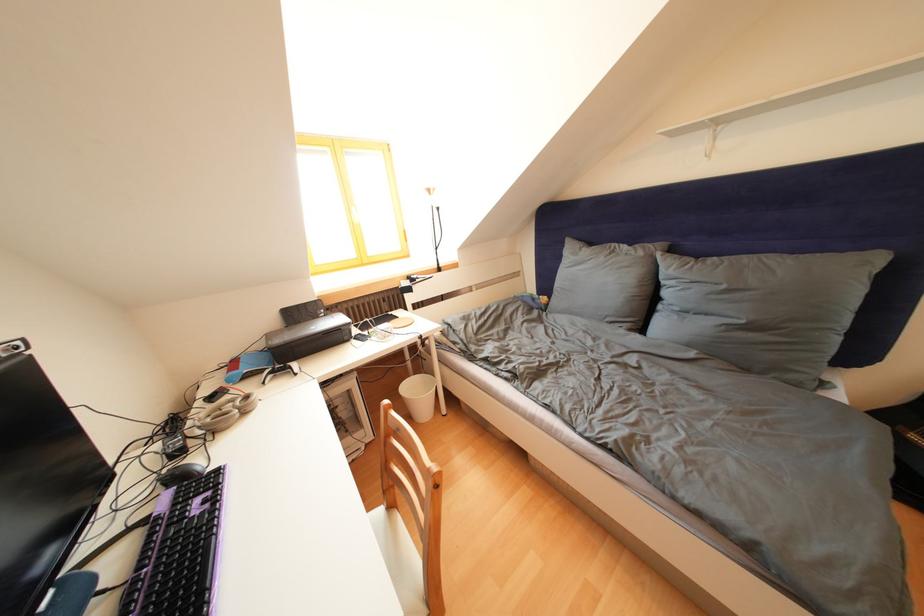
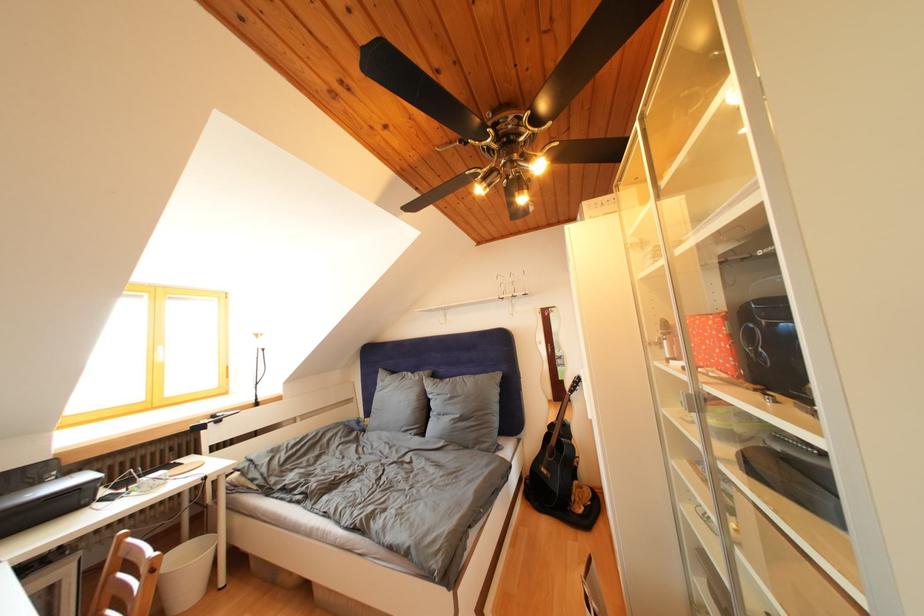
The point at (323, 322) is marked in the first image. Where is the corresponding point in the second image?

(44, 488)